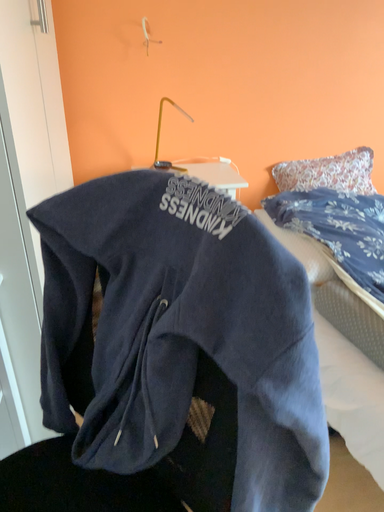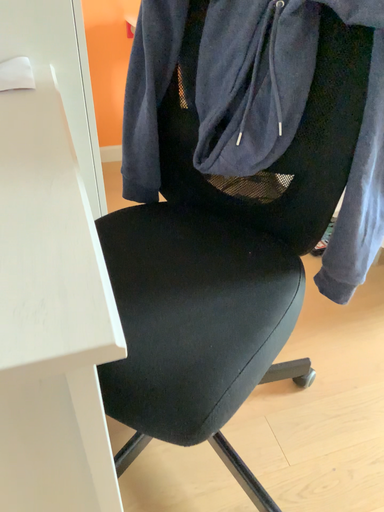
Question: Which way did the camera rotate in the video?

Choices:
 (A) rotated upward
 (B) rotated downward

Answer: (B)